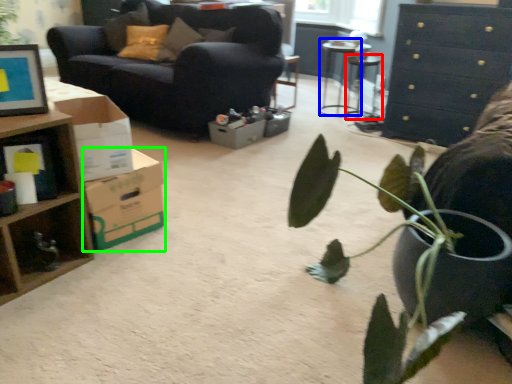
Question: Which object is the farthest from table (highlighted by a red box)? Choose among these: table (highlighted by a blue box) or cardboard box (highlighted by a green box).

Choices:
 (A) table
 (B) cardboard box

Answer: (B)